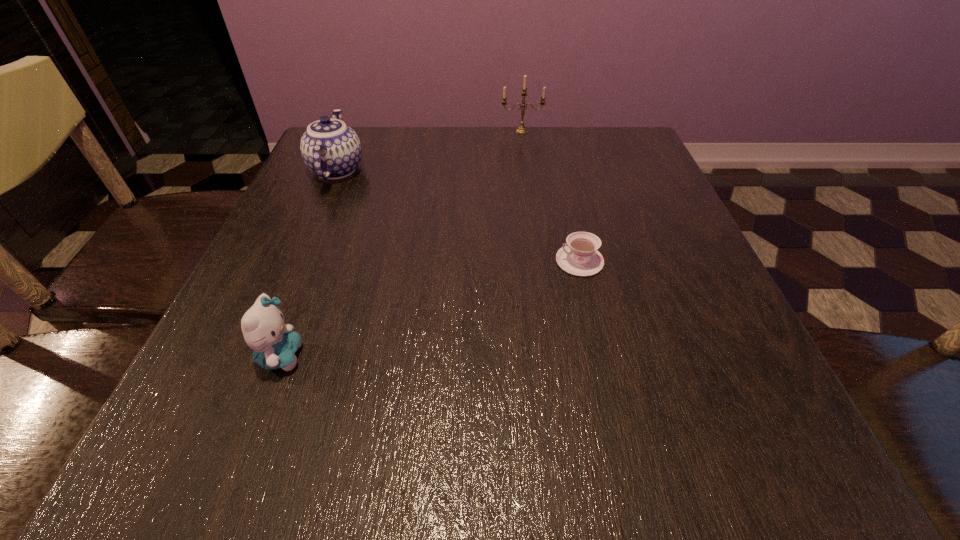
This screenshot has width=960, height=540. What are the coordinates of `free space between the teacup and the kitten` in the screenshot? It's located at (x=430, y=308).

Identify the location of free space between the chinaware and the teacup. (458, 215).

Identify which object is located as the second nearest to the farthest object. Please provide its 2D coordinates. Your answer should be formatted as a tuple, i.e. [(x, y)], where the tuple contains the x and y coordinates of a point satisfying the conditions above.

[(579, 256)]

Where is `the second closest object to the second nearest object`? Image resolution: width=960 pixels, height=540 pixels. the second closest object to the second nearest object is located at coordinates (331, 149).

I want to click on free spot that satisfies the following two spatial constraints: 1. at the spout of the farthest object; 2. on the right side of the chinaware, so click(x=353, y=131).

Identify the location of free spot that satisfies the following two spatial constraints: 1. at the spout of the farthest object; 2. on the left side of the third nearest object. (353, 131).

Image resolution: width=960 pixels, height=540 pixels. I want to click on vacant space that satisfies the following two spatial constraints: 1. at the spout of the chinaware; 2. on the left side of the farthest object, so click(353, 131).